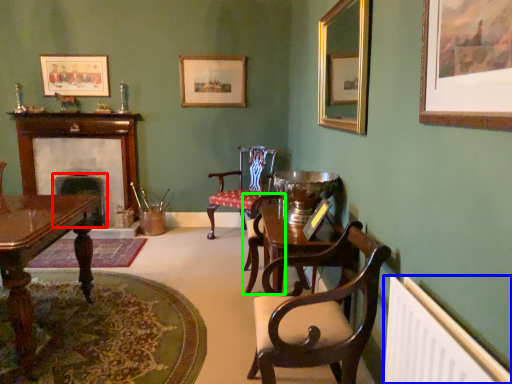
Question: Estimate the real-world distances between objects in this image. Which object is closer to fireplace (highlighted by a red box), radiator (highlighted by a blue box) or armchair (highlighted by a green box)?

Choices:
 (A) radiator
 (B) armchair

Answer: (B)